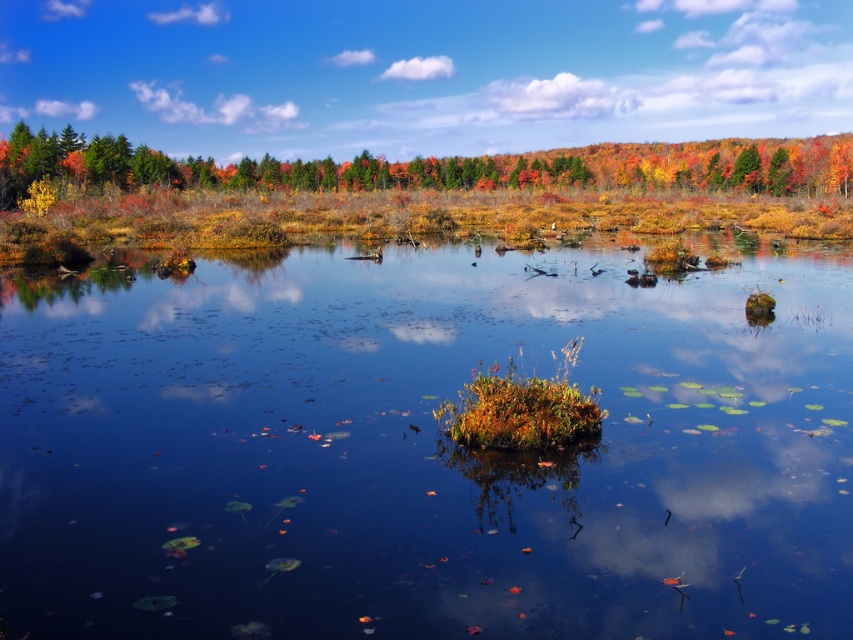
Is autumn foliage at upper center taller than green matte tree at upper right?

Yes, autumn foliage at upper center is taller than green matte tree at upper right.

Does autumn foliage at upper center appear on the left side of green matte tree at upper right?

Indeed, autumn foliage at upper center is positioned on the left side of green matte tree at upper right.

Is point (788, 157) behind point (730, 177)?

Yes, point (788, 157) is farther from viewer.

You are a GUI agent. You are given a task and a screenshot of the screen. Output one action in this format:
    pyautogui.click(x=<x>, y=<y>)
    Task: Click on the autumn foliage at upper center
    The image size is (853, 640).
    Given the screenshot: What is the action you would take?
    pyautogui.click(x=433, y=188)

From the picture: Is green mossy rock at center thinner than autumn foliage at upper center?

Correct, green mossy rock at center's width is less than autumn foliage at upper center's.

The height and width of the screenshot is (640, 853). What do you see at coordinates (424, 449) in the screenshot?
I see `green mossy rock at center` at bounding box center [424, 449].

Find the location of a particular element. Image resolution: width=853 pixels, height=640 pixels. green mossy rock at center is located at coordinates [x=424, y=449].

Is green matte tree at upper right closer to camera compared to orange autumn leaves at upper right?

That is False.

Between green matte tree at upper right and orange autumn leaves at upper right, which one has less height?

Standing shorter between the two is green matte tree at upper right.

Which is behind, point (755, 177) or point (782, 152)?

The point (782, 152) is behind.

The image size is (853, 640). Find the location of `green matte tree at upper right`. green matte tree at upper right is located at coordinates (747, 168).